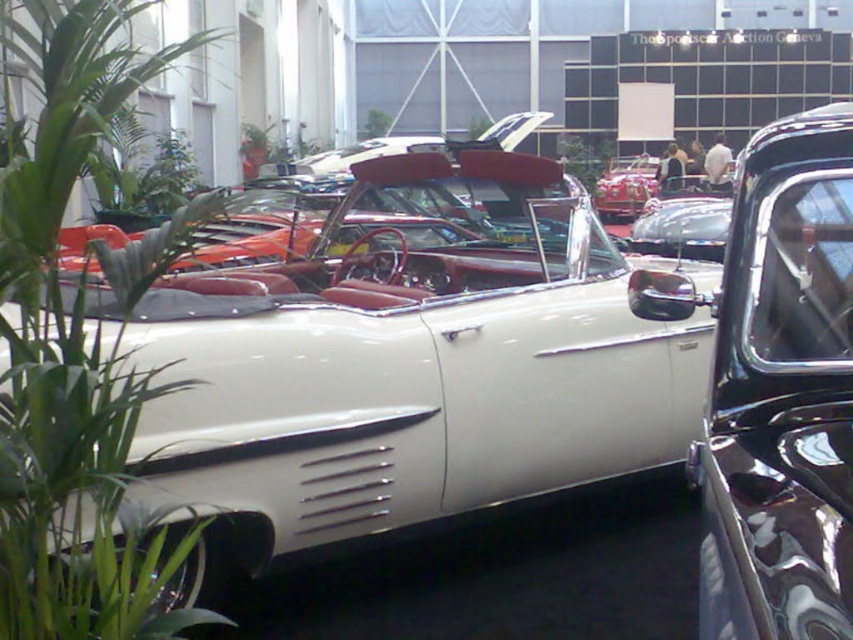
You are standing in the middle of the room and want to place a new potted plant exactly at the point marked by the coordinates point (78, 348). Can you confirm if that location is currently occupied by an object?

Yes, the point (78, 348) is currently occupied by a green leafy plant at left.

You are a photographer positioned at the entrance of the exhibition hall. You need to capture a photo that includes both the green leafy plant at left and the glossy black car at center. Based on their positions, which object should you frame first in your camera viewfinder to ensure both are in the shot?

The green leafy plant at left should be framed first since it is positioned to the left of the glossy black car at center, so starting with the plant ensures both objects are included in the frame.